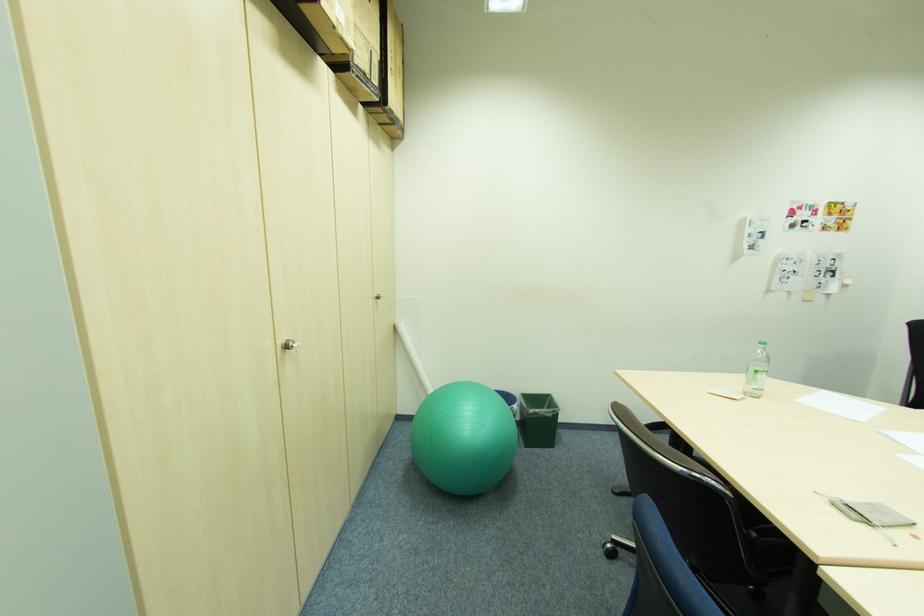
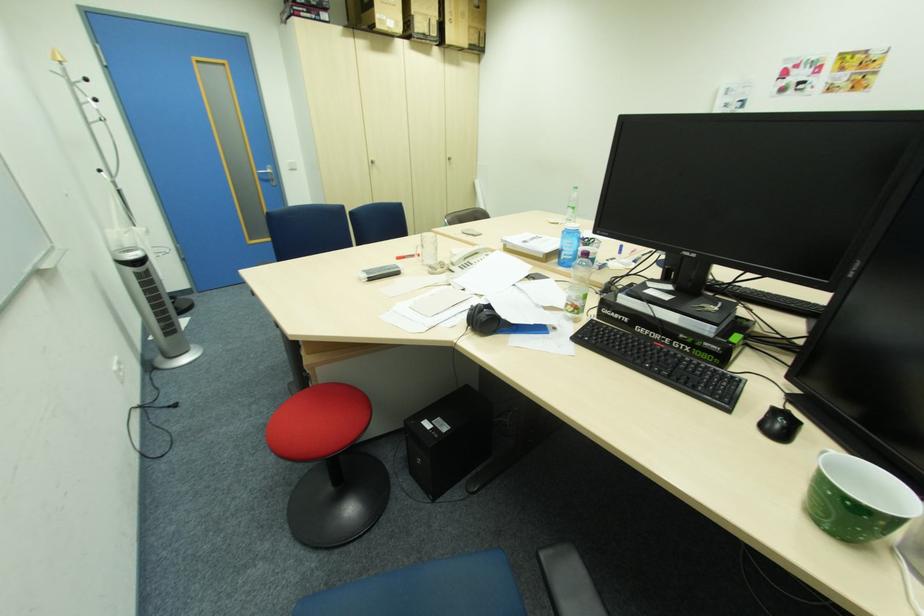
In the second image, find the point that corresponds to [383,299] in the first image.

(456, 159)